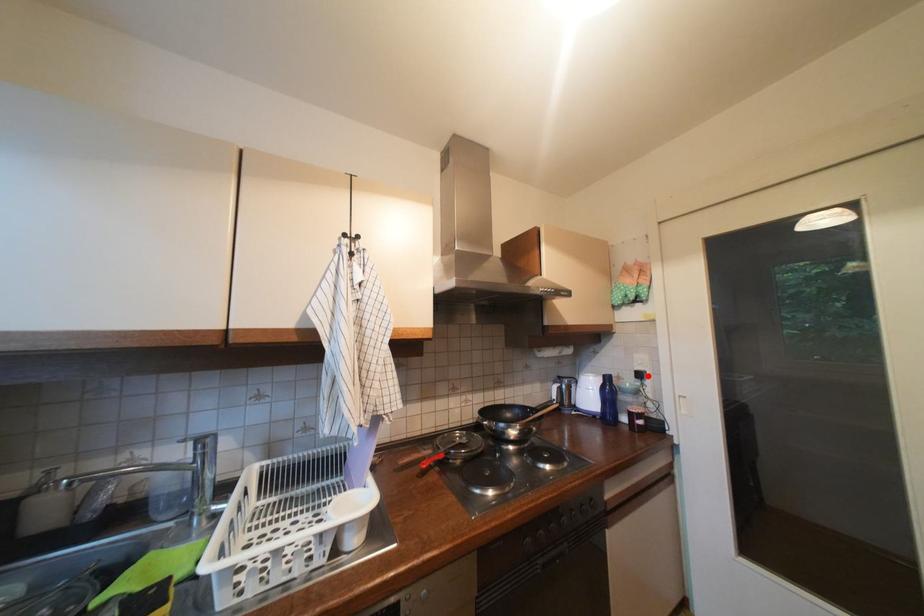
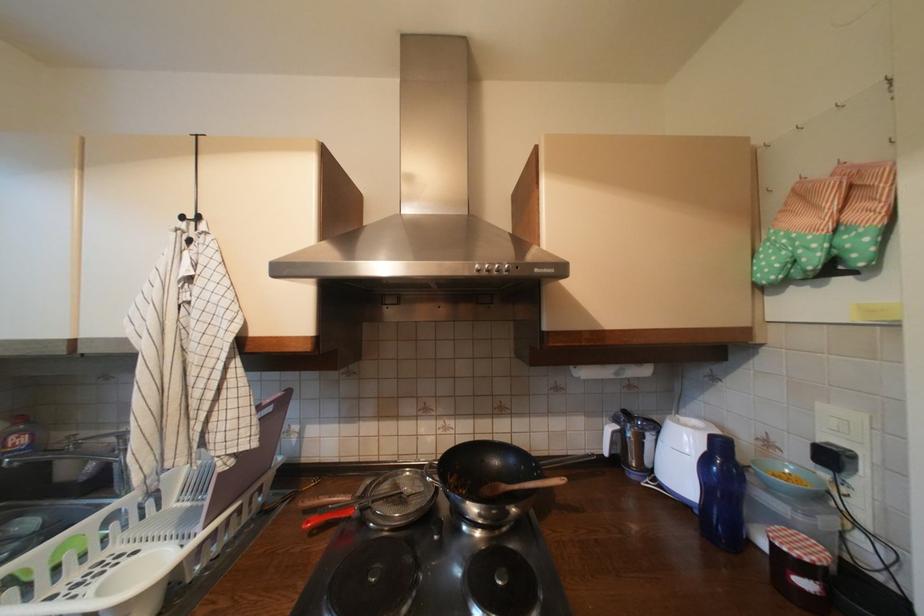
The point at the highlighted location is marked in the first image. Where is the corresponding point in the second image?

(840, 459)